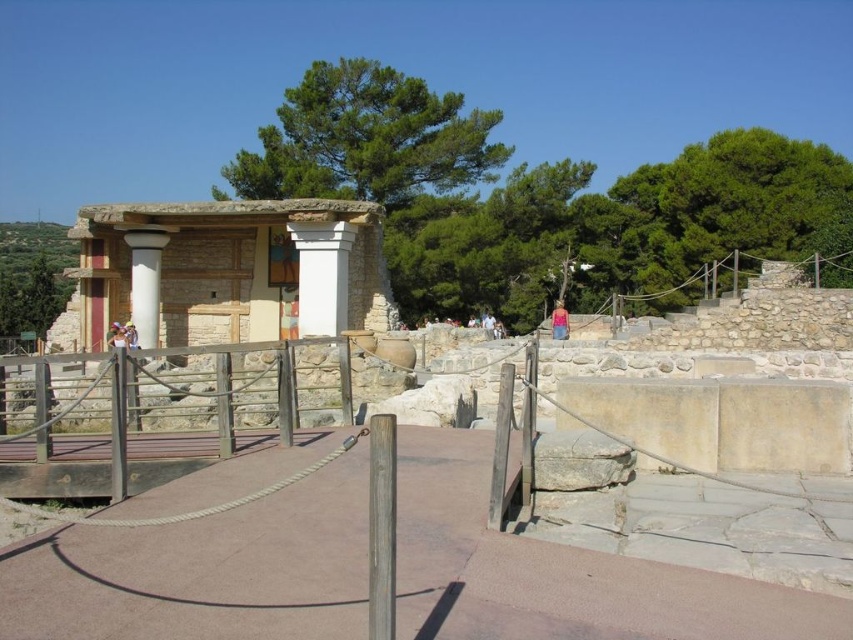
You are a tour guide leading a group at the archaeological site. You notice a visitor standing at the center of the walkway. You want to ensure they are following the path. Are they standing on the paved walkway bordered by wooden posts and ropes, or near the white stone column at center or blue denim shorts at center?

The visitor is standing on the paved walkway bordered by wooden posts and ropes because the white stone column at center is taller than the blue denim shorts at center, indicating they are on the designated path.

You are a tour guide standing at the entrance of the archaeological site. You notice a tourist wearing blue denim shorts at center and a white stone column at center. If the walkway is 40 feet wide, can the tourist walk from their current position to the column without stepping off the walkway?

The white stone column at center and blue denim shorts at center are 42.42 feet apart. Since the walkway is only 40 feet wide, the tourist would need to step off the walkway to reach the column.

You are a tour guide leading a group to the white stone amphitheater at center. You notice a visitor is standing near the white marble column at left. Which direction should they move to reach the amphitheater?

The visitor should move to the right since the white stone amphitheater at center is to the right of the white marble column at left.